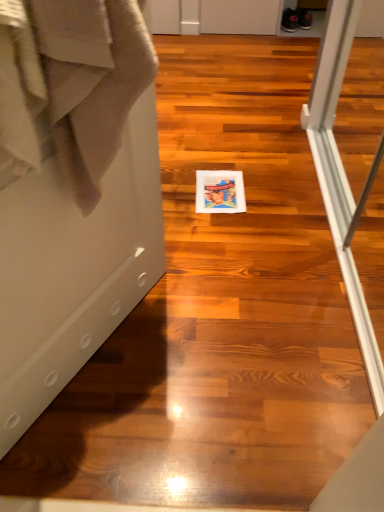
What do you see at coordinates (73, 271) in the screenshot? I see `white glossy screen door at center` at bounding box center [73, 271].

What do you see at coordinates (220, 192) in the screenshot? The height and width of the screenshot is (512, 384). I see `matte paper postcard at center` at bounding box center [220, 192].

At what (x,y) coordinates should I click in order to perform the action: click on white glossy screen door at center. Please return your answer as a coordinate pair (x, y). Image resolution: width=384 pixels, height=512 pixels. Looking at the image, I should click on (73, 271).

Is beige cotton bath towel at left inside the boundaries of matte paper postcard at center, or outside?

beige cotton bath towel at left is not inside matte paper postcard at center, it's outside.

Is beige cotton bath towel at left with matte paper postcard at center?

There is a gap between beige cotton bath towel at left and matte paper postcard at center.

From a real-world perspective, is beige cotton bath towel at left on top of matte paper postcard at center?

Correct, in the physical world, beige cotton bath towel at left is higher than matte paper postcard at center.

Is beige cotton bath towel at left facing towards matte paper postcard at center?

No.

Can you tell me how much white glossy screen door at center and beige cotton bath towel at left differ in facing direction?

The angular difference between white glossy screen door at center and beige cotton bath towel at left is 0.00233 degrees.

How much distance is there between white glossy screen door at center and beige cotton bath towel at left?

white glossy screen door at center and beige cotton bath towel at left are 10.25 inches apart from each other.

Image resolution: width=384 pixels, height=512 pixels. In order to click on bath towel above the white glossy screen door at center (from the image's perspective) in this screenshot , I will do `click(71, 83)`.

Does white glossy screen door at center have a lesser width compared to beige cotton bath towel at left?

Indeed, white glossy screen door at center has a lesser width compared to beige cotton bath towel at left.

At what (x,y) coordinates should I click in order to perform the action: click on bath towel above the matte paper postcard at center (from a real-world perspective). Please return your answer as a coordinate pair (x, y). The height and width of the screenshot is (512, 384). Looking at the image, I should click on (71, 83).

Which point is more distant from viewer, [206,186] or [49,0]?

The point [206,186] is behind.

From the image's perspective, is matte paper postcard at center over beige cotton bath towel at left?

Correct, matte paper postcard at center appears higher than beige cotton bath towel at left in the image.

Does matte paper postcard at center have a greater height compared to beige cotton bath towel at left?

No.

From a real-world perspective, is white glossy screen door at center on matte paper postcard at center?

Correct, in the physical world, white glossy screen door at center is higher than matte paper postcard at center.

Considering the relative positions of white glossy screen door at center and matte paper postcard at center in the image provided, is white glossy screen door at center to the right of matte paper postcard at center from the viewer's perspective?

Incorrect, white glossy screen door at center is not on the right side of matte paper postcard at center.

Which object is thinner, white glossy screen door at center or matte paper postcard at center?

white glossy screen door at center is thinner.

Consider the image. Which is more to the right, beige cotton bath towel at left or white glossy screen door at center?

beige cotton bath towel at left.

Locate an element on the screen. screen door located on the left of beige cotton bath towel at left is located at coordinates (73, 271).

In terms of width, does beige cotton bath towel at left look wider or thinner when compared to white glossy screen door at center?

Clearly, beige cotton bath towel at left has more width compared to white glossy screen door at center.

Is point (220, 192) more distant than point (59, 314)?

Yes, it is behind point (59, 314).

Is matte paper postcard at center to the right of white glossy screen door at center from the viewer's perspective?

Yes.

Can you confirm if matte paper postcard at center is taller than white glossy screen door at center?

In fact, matte paper postcard at center may be shorter than white glossy screen door at center.

Identify the location of bath towel on the left of the matte paper postcard at center. The image size is (384, 512). (71, 83).

Where is `screen door below the beige cotton bath towel at left (from the image's perspective)`? Image resolution: width=384 pixels, height=512 pixels. screen door below the beige cotton bath towel at left (from the image's perspective) is located at coordinates (73, 271).

Considering their positions, is white glossy screen door at center positioned further to matte paper postcard at center than beige cotton bath towel at left?

The object further to matte paper postcard at center is beige cotton bath towel at left.

Based on their spatial positions, is beige cotton bath towel at left or matte paper postcard at center closer to white glossy screen door at center?

Based on the image, beige cotton bath towel at left appears to be nearer to white glossy screen door at center.

Based on their spatial positions, is white glossy screen door at center or matte paper postcard at center closer to beige cotton bath towel at left?

white glossy screen door at center.

Estimate the real-world distances between objects in this image. Which object is further from matte paper postcard at center, beige cotton bath towel at left or white glossy screen door at center?

beige cotton bath towel at left lies further to matte paper postcard at center than the other object.

Estimate the real-world distances between objects in this image. Which object is further from white glossy screen door at center, matte paper postcard at center or beige cotton bath towel at left?

matte paper postcard at center is further to white glossy screen door at center.

Considering their positions, is matte paper postcard at center positioned closer to beige cotton bath towel at left than white glossy screen door at center?

white glossy screen door at center.

The image size is (384, 512). I want to click on bath towel positioned between white glossy screen door at center and matte paper postcard at center from near to far, so click(71, 83).